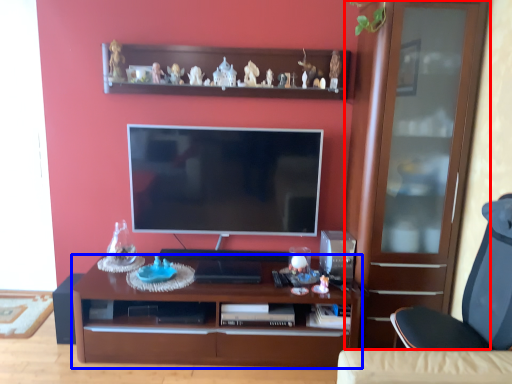
Question: Which object appears closest to the camera in this image, cabinetry (highlighted by a red box) or desk (highlighted by a blue box)?

Choices:
 (A) cabinetry
 (B) desk

Answer: (A)